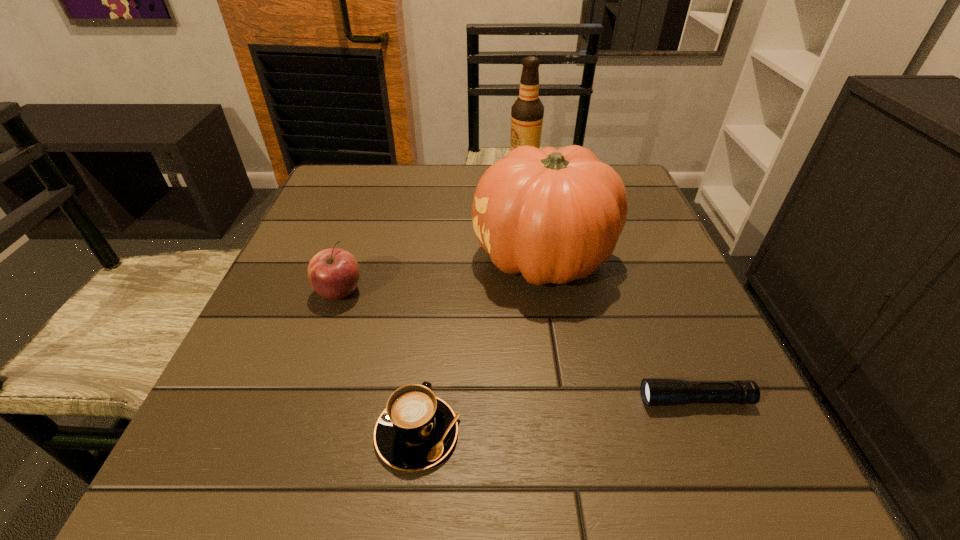
At what (x,y) coordinates should I click in order to perform the action: click on alcohol. Please return your answer as a coordinate pair (x, y). The height and width of the screenshot is (540, 960). Looking at the image, I should click on (527, 113).

The image size is (960, 540). I want to click on the farthest object, so click(527, 113).

This screenshot has height=540, width=960. Find the location of `the second tallest object`. the second tallest object is located at coordinates [x=555, y=216].

Where is `the leftmost object`? This screenshot has width=960, height=540. the leftmost object is located at coordinates tap(333, 273).

Find the location of a particular element. the third shortest object is located at coordinates (333, 273).

You are a GUI agent. You are given a task and a screenshot of the screen. Output one action in this format:
    pyautogui.click(x=<x>, y=<y>)
    Task: Click on the fourth tallest object
    The image size is (960, 540).
    Given the screenshot: What is the action you would take?
    pyautogui.click(x=417, y=430)

This screenshot has height=540, width=960. Find the location of `cappuccino`. cappuccino is located at coordinates (417, 430).

Where is `flashlight`? The height and width of the screenshot is (540, 960). flashlight is located at coordinates (654, 391).

I want to click on vacant area situated on the label of the tallest object, so click(x=372, y=174).

Identify the location of free space located on the label of the tallest object. This screenshot has width=960, height=540. point(375,174).